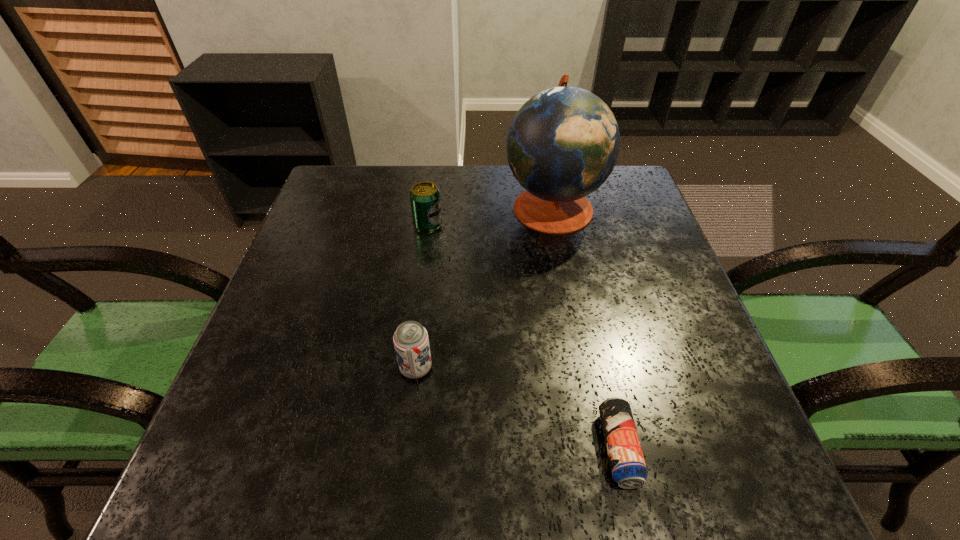
This screenshot has height=540, width=960. Identify the location of vacant region at the near right corner. (732, 464).

Identify the location of empty space that is in between the nearest beer can and the second nearest beer can. (517, 408).

What are the coordinates of `free spot between the second farthest beer can and the tallest object` in the screenshot? It's located at (484, 287).

The width and height of the screenshot is (960, 540). Find the location of `empty space between the farthest beer can and the tallest object`. empty space between the farthest beer can and the tallest object is located at coordinates (491, 216).

Find the location of a particular element. The width and height of the screenshot is (960, 540). unoccupied position between the nearest beer can and the tallest object is located at coordinates (586, 327).

This screenshot has height=540, width=960. Find the location of `free space between the globe and the second nearest beer can`. free space between the globe and the second nearest beer can is located at coordinates (484, 287).

The image size is (960, 540). I want to click on free space between the rightmost beer can and the second nearest object, so click(x=517, y=408).

The height and width of the screenshot is (540, 960). Identify the location of unoccupied position between the shortest beer can and the tallest object. (586, 327).

The height and width of the screenshot is (540, 960). Identify the location of empty space between the tallest object and the second nearest beer can. (484, 287).

The width and height of the screenshot is (960, 540). What are the coordinates of `vacant space that's between the farthest beer can and the second farthest beer can` in the screenshot? It's located at (422, 296).